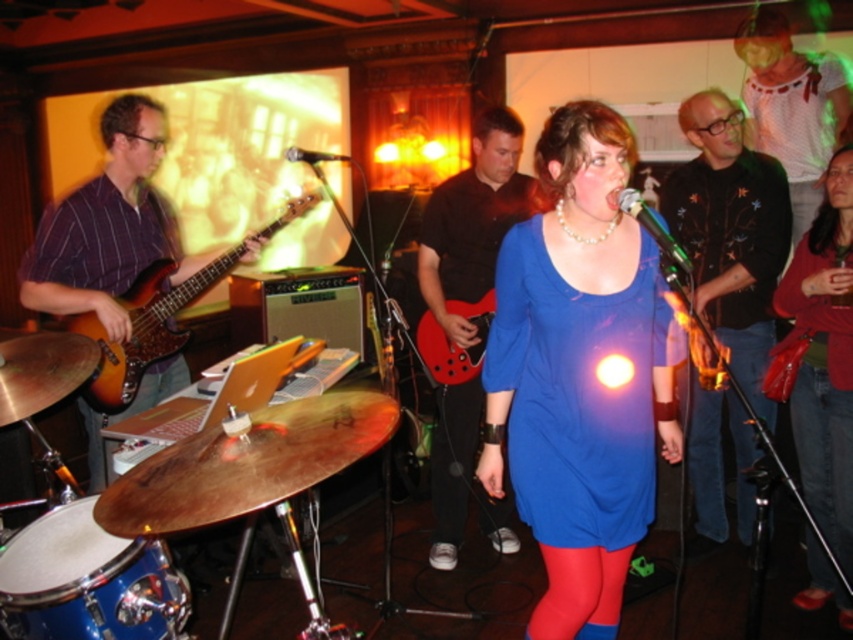
Question: In this image, where is blue polished wood drum at lower left located relative to sunburst wood guitar at left?

Choices:
 (A) right
 (B) left

Answer: (A)

Question: Among these points, which one is nearest to the camera?

Choices:
 (A) (444, 365)
 (B) (759, 220)
 (C) (573, 272)
 (D) (840, 627)

Answer: (C)

Question: Which object is closer to the camera taking this photo?

Choices:
 (A) red sweater at right
 (B) black leather jacket at upper right

Answer: (A)

Question: Can you confirm if black leather jacket at upper right is positioned above matte black guitar at center?

Choices:
 (A) yes
 (B) no

Answer: (A)

Question: Which point is farther to the camera?

Choices:
 (A) metallic silver microphone at center
 (B) red sweater at right
 (C) sunburst wood bass guitar at left

Answer: (C)

Question: Is sunburst wood bass guitar at left in front of matte black guitar at center?

Choices:
 (A) yes
 (B) no

Answer: (A)